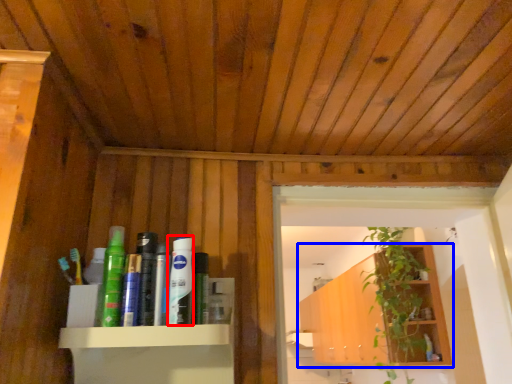
Question: Which point is further to the camera, toiletry (highlighted by a red box) or shelf (highlighted by a blue box)?

Choices:
 (A) toiletry
 (B) shelf

Answer: (B)